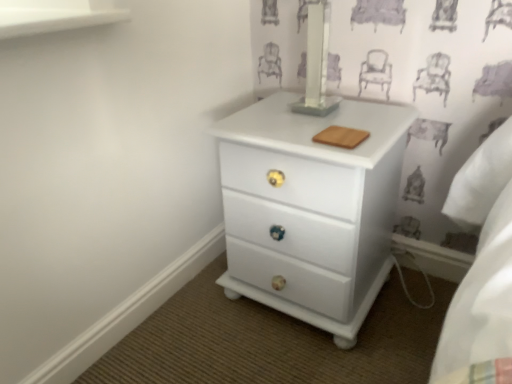
The width and height of the screenshot is (512, 384). Find the location of `vacant space situated above white painted wood chest of drawers at center (from a real-world perspective)`. vacant space situated above white painted wood chest of drawers at center (from a real-world perspective) is located at coordinates (315, 118).